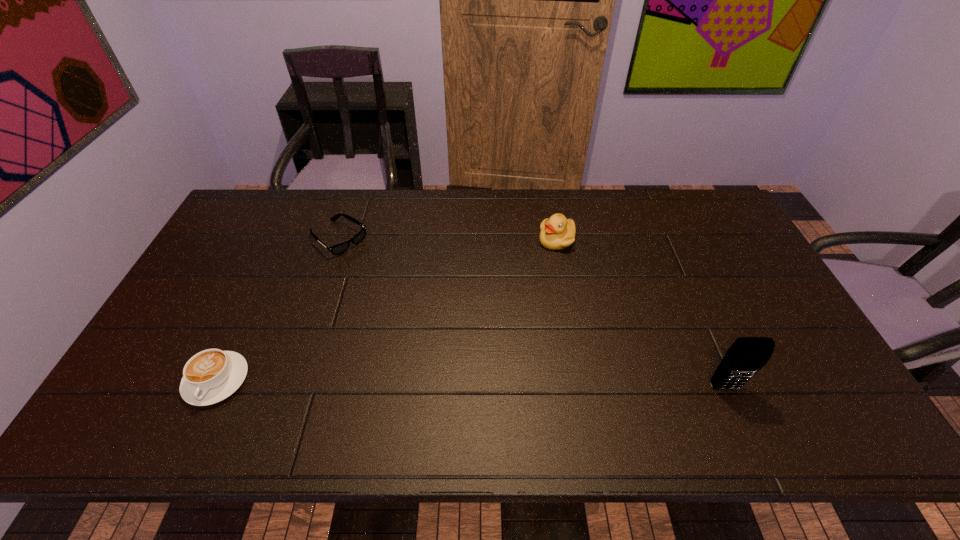
I want to click on cappuccino, so click(x=210, y=376).

Where is `the second shortest object`? Image resolution: width=960 pixels, height=540 pixels. the second shortest object is located at coordinates (210, 376).

Locate an element on the screen. Image resolution: width=960 pixels, height=540 pixels. the rightmost object is located at coordinates (746, 356).

The image size is (960, 540). Identify the location of cellular telephone. (746, 356).

This screenshot has height=540, width=960. In order to click on the second object from left to right in this screenshot , I will do `click(337, 249)`.

Identify the location of the shortest object. (337, 249).

Identify the location of the third object from left to right. (557, 232).

What are the coordinates of `duckling` in the screenshot? It's located at (557, 232).

Image resolution: width=960 pixels, height=540 pixels. Identify the location of vacant region located 0.160m on the front-facing side of the shortest object. (389, 276).

You are a GUI agent. You are given a task and a screenshot of the screen. Output one action in this format:
    pyautogui.click(x=<x>, y=<y>)
    Task: Click on the vacant space located 0.200m on the front-facing side of the shortest object
    This screenshot has width=960, height=540.
    Given the screenshot: What is the action you would take?
    pyautogui.click(x=397, y=283)